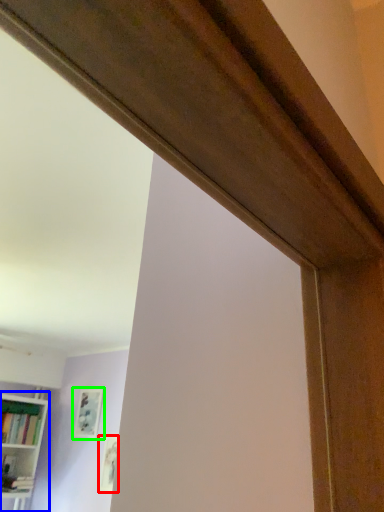
Question: Which is nearer to the picture frame (highlighted by a red box)? bookcase (highlighted by a blue box) or picture frame (highlighted by a green box).

Choices:
 (A) bookcase
 (B) picture frame

Answer: (B)